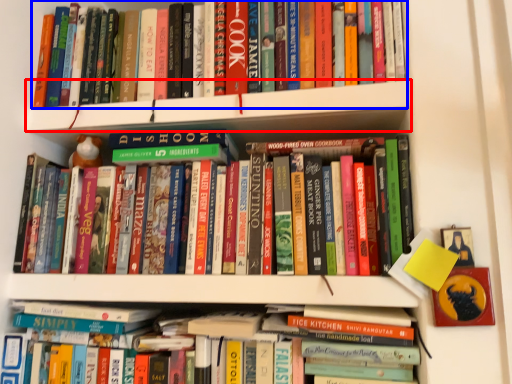
Question: Which object is further to the camera taking this photo, shelf (highlighted by a red box) or book (highlighted by a blue box)?

Choices:
 (A) shelf
 (B) book

Answer: (B)